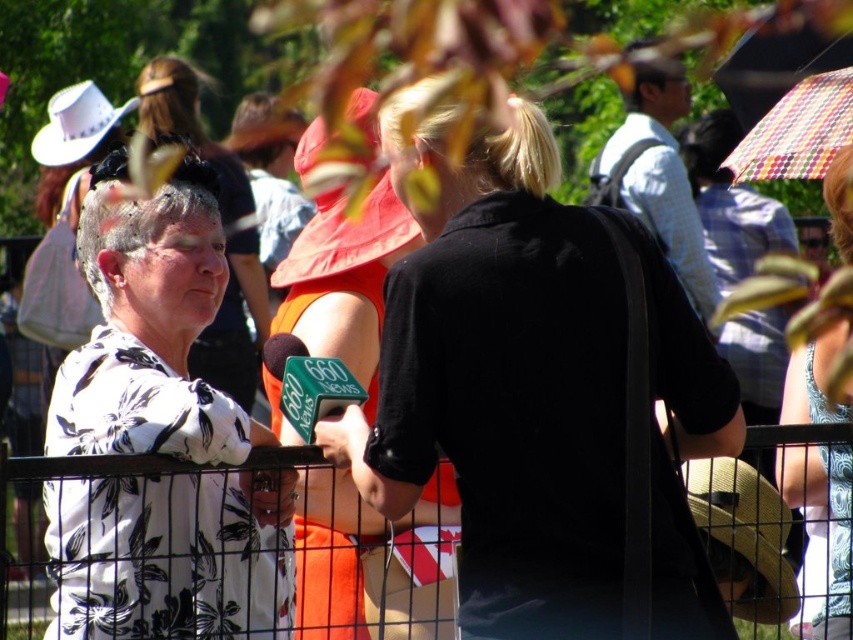
Question: Which point is closer to the camera?

Choices:
 (A) patterned fabric dress at center
 (B) white felt cowboy hat at upper left
 (C) orange fabric hat at center

Answer: (A)

Question: Which of the following is the closest to the observer?

Choices:
 (A) white floral shirt at left
 (B) black metal fence at center
 (C) white floral dress at left

Answer: (B)

Question: Among these objects, which one is nearest to the camera?

Choices:
 (A) black matte shirt at center
 (B) brown straw cowboy hat at lower right
 (C) white felt cowboy hat at upper left
 (D) black metal fence at center

Answer: (D)

Question: In this image, where is white floral shirt at left located relative to white felt cowboy hat at upper left?

Choices:
 (A) below
 (B) above

Answer: (A)

Question: Is black matte shirt at center in front of patterned fabric dress at center?

Choices:
 (A) no
 (B) yes

Answer: (B)

Question: Does black metal fence at center come in front of white felt cowboy hat at upper left?

Choices:
 (A) yes
 (B) no

Answer: (A)